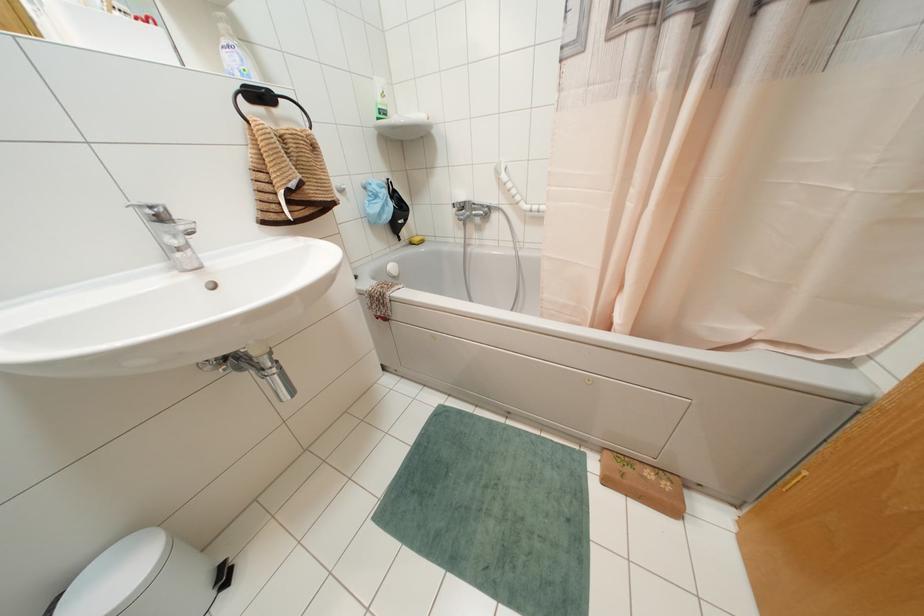
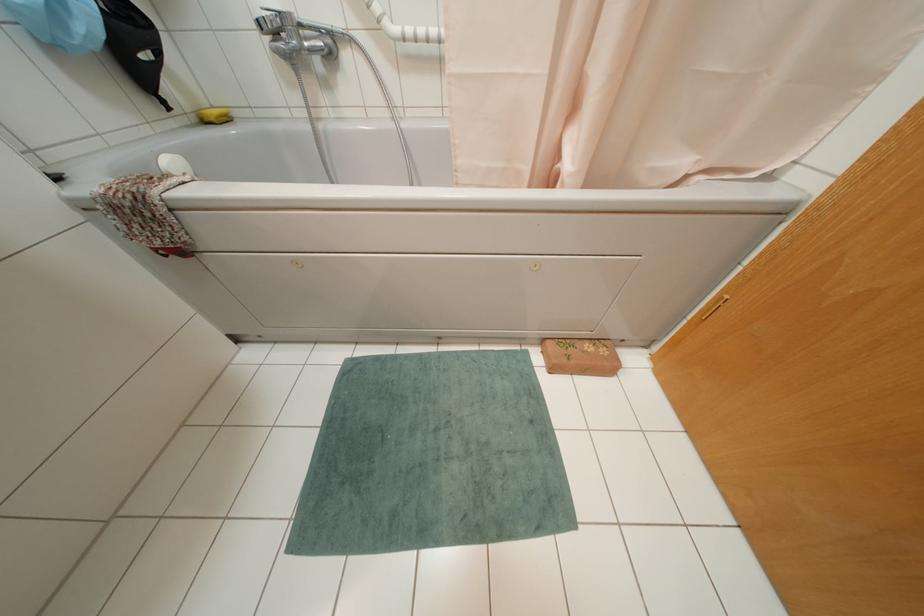
The point at (409, 243) is marked in the first image. Where is the corresponding point in the second image?

(202, 121)